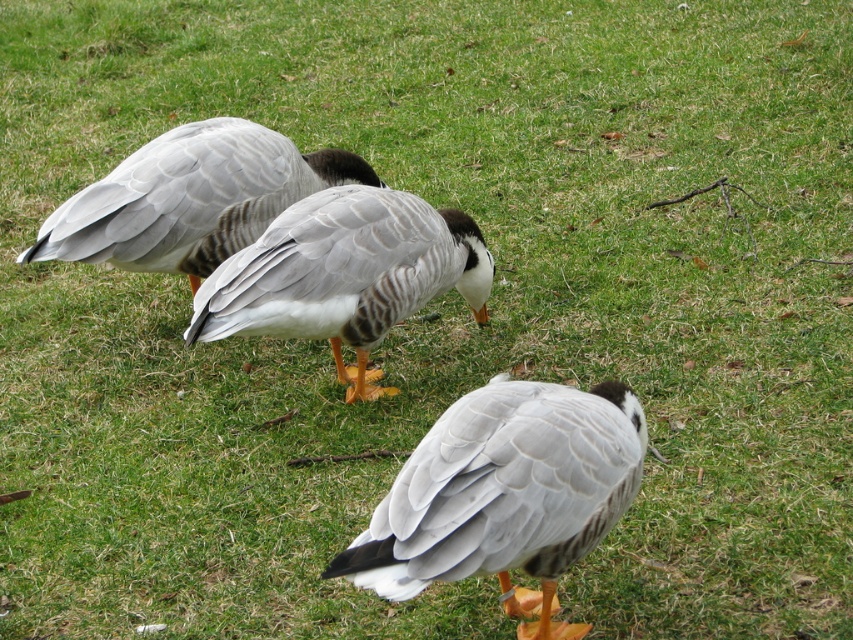
Question: Which point is farther to the camera?

Choices:
 (A) [228, 163]
 (B) [380, 589]

Answer: (A)

Question: Is gray feathered duck at center thinner than gray matte duck at upper left?

Choices:
 (A) no
 (B) yes

Answer: (B)

Question: Estimate the real-world distances between objects in this image. Which object is closer to the white feathered duck at center?

Choices:
 (A) gray feathered duck at center
 (B) gray matte duck at upper left

Answer: (A)

Question: Does white feathered duck at center appear over gray matte duck at upper left?

Choices:
 (A) yes
 (B) no

Answer: (B)

Question: Estimate the real-world distances between objects in this image. Which object is closer to the white feathered duck at center?

Choices:
 (A) gray matte duck at upper left
 (B) gray feathered duck at center

Answer: (B)

Question: Does white feathered duck at center have a smaller size compared to gray feathered duck at center?

Choices:
 (A) yes
 (B) no

Answer: (A)